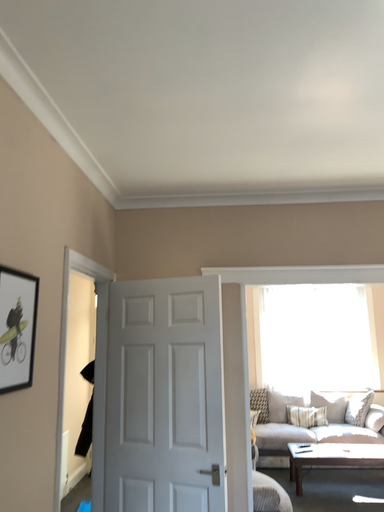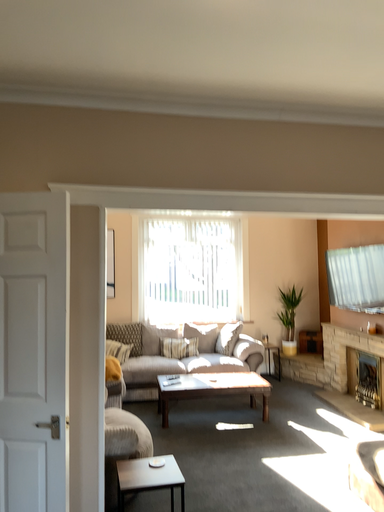
Question: How did the camera likely rotate when shooting the video?

Choices:
 (A) rotated left
 (B) rotated right

Answer: (B)